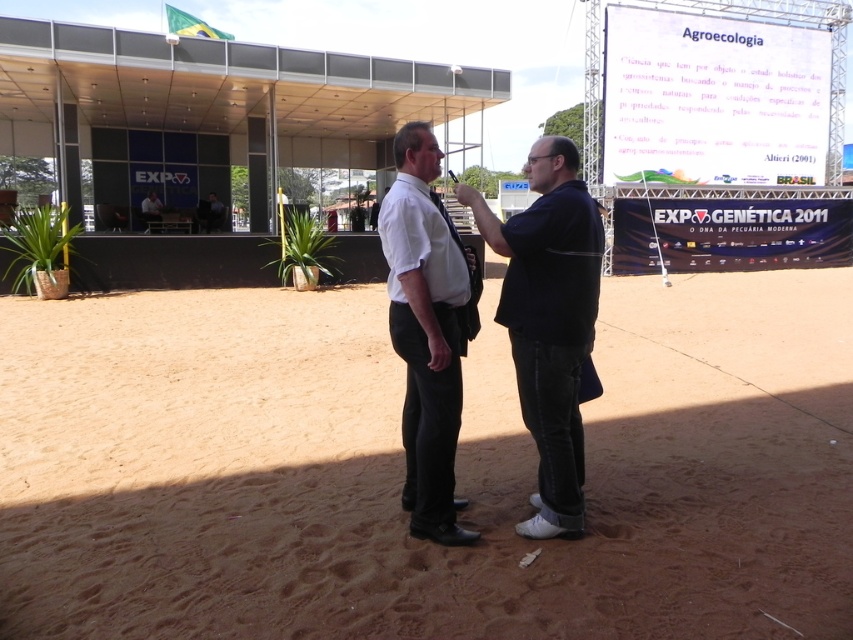
Question: Which point is closer to the camera taking this photo?

Choices:
 (A) (552, 461)
 (B) (399, 260)
 (C) (822, 589)

Answer: (C)

Question: Which point is closer to the camera?

Choices:
 (A) (544, 522)
 (B) (486, 544)

Answer: (B)

Question: Does dark blue shirt at center have a larger size compared to white shirt at center?

Choices:
 (A) yes
 (B) no

Answer: (A)

Question: Which of the following is the farthest from the observer?

Choices:
 (A) dark blue shirt at center
 (B) white shirt at center

Answer: (A)

Question: Does dark blue shirt at center come behind white shirt at center?

Choices:
 (A) no
 (B) yes

Answer: (B)

Question: Does brown sandy ground at center have a greater width compared to dark blue shirt at center?

Choices:
 (A) no
 (B) yes

Answer: (B)